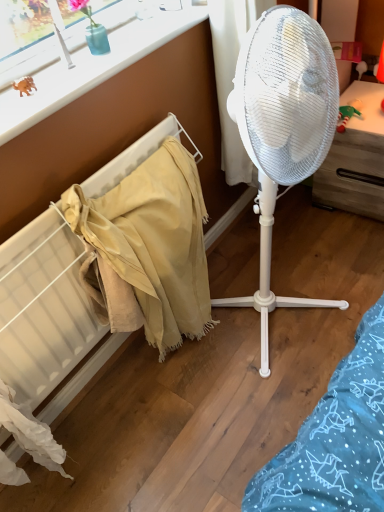
This screenshot has width=384, height=512. What do you see at coordinates (25, 86) in the screenshot? I see `rubber orange dinosaur at upper left` at bounding box center [25, 86].

Where is `white plastic drawer at right`? white plastic drawer at right is located at coordinates (356, 158).

This screenshot has width=384, height=512. What do you see at coordinates (119, 258) in the screenshot? I see `beige fabric at left` at bounding box center [119, 258].

Locate an element on the screen. white plastic window frame at upper left is located at coordinates (91, 69).

Image resolution: width=384 pixels, height=512 pixels. In the image, there is a white plastic window frame at upper left. What are the coordinates of `mechanical fan below it (from a real-world perspective)` in the screenshot? It's located at (282, 129).

Considering the positions of points (42, 117) and (247, 110), is point (42, 117) farther from camera compared to point (247, 110)?

Yes.

Is white plastic window frame at upper left not near white plastic fan at center?

No.

Relative to white plastic window frame at upper left, is white plastic fan at center in front or behind?

white plastic fan at center is positioned closer to the viewer than white plastic window frame at upper left.

Is white plastic fan at center smaller than white plastic window frame at upper left?

Actually, white plastic fan at center might be larger than white plastic window frame at upper left.

Between point (330, 129) and point (119, 32), which one is positioned behind?

The point (119, 32) is behind.

Is white plastic fan at center taller than white plastic window frame at upper left?

Correct, white plastic fan at center is much taller as white plastic window frame at upper left.

Is white plastic drawer at right inside or outside of white plastic window frame at upper left?

white plastic drawer at right is not inside white plastic window frame at upper left, it's outside.

Is white plastic drawer at right beside white plastic window frame at upper left?

No, white plastic drawer at right is not in contact with white plastic window frame at upper left.

Where is `furniture below the white plastic window frame at upper left (from a real-world perspective)`? The height and width of the screenshot is (512, 384). furniture below the white plastic window frame at upper left (from a real-world perspective) is located at coordinates (356, 158).

Can you tell me how much white plastic drawer at right and white plastic window frame at upper left differ in facing direction?

The angular difference between white plastic drawer at right and white plastic window frame at upper left is 89.4 degrees.

From the image's perspective, which one is positioned higher, rubber orange dinosaur at upper left or beige fabric at left?

rubber orange dinosaur at upper left.

Can you confirm if rubber orange dinosaur at upper left is taller than beige fabric at left?

No.

Locate an element on the screen. Image resolution: width=384 pixels, height=512 pixels. radiator directly beneath the rubber orange dinosaur at upper left (from a real-world perspective) is located at coordinates (119, 258).

Is rubber orange dinosaur at upper left not close to beige fabric at left?

rubber orange dinosaur at upper left is near beige fabric at left, not far away.

Looking at this image, can we say rubber orange dinosaur at upper left lies outside white plastic drawer at right?

rubber orange dinosaur at upper left is positioned outside white plastic drawer at right.

Considering the positions of objects rubber orange dinosaur at upper left and white plastic drawer at right in the image provided, who is in front, rubber orange dinosaur at upper left or white plastic drawer at right?

rubber orange dinosaur at upper left is closer to the camera.

Is rubber orange dinosaur at upper left at the left side of white plastic drawer at right?

Yes.

Does rubber orange dinosaur at upper left turn towards white plastic drawer at right?

No, rubber orange dinosaur at upper left does not turn towards white plastic drawer at right.

This screenshot has height=512, width=384. In order to click on toy above the white plastic fan at center (from the image's perspective) in this screenshot , I will do 25,86.

Can you confirm if white plastic fan at center is shorter than rubber orange dinosaur at upper left?

No, white plastic fan at center is not shorter than rubber orange dinosaur at upper left.

From a real-world perspective, between white plastic fan at center and rubber orange dinosaur at upper left, who is vertically lower?

From a 3D spatial view, white plastic fan at center is below.

Which object is further away from the camera taking this photo, white plastic fan at center or rubber orange dinosaur at upper left?

rubber orange dinosaur at upper left is further from the camera.

Is rubber orange dinosaur at upper left surrounded by white plastic drawer at right?

No, rubber orange dinosaur at upper left is located outside of white plastic drawer at right.

Which is more to the right, white plastic drawer at right or rubber orange dinosaur at upper left?

white plastic drawer at right.

What's the angular difference between white plastic drawer at right and rubber orange dinosaur at upper left's facing directions?

The angular difference between white plastic drawer at right and rubber orange dinosaur at upper left is 93.2 degrees.

Is white plastic drawer at right with rubber orange dinosaur at upper left?

No, white plastic drawer at right is not touching rubber orange dinosaur at upper left.

In order to click on mechanical fan in front of the white plastic window frame at upper left in this screenshot , I will do `click(282, 129)`.

I want to click on window frame behind the white plastic fan at center, so click(91, 69).

Estimate the real-world distances between objects in this image. Which object is closer to white plastic fan at center, white plastic window frame at upper left or beige fabric at left?

white plastic window frame at upper left lies closer to white plastic fan at center than the other object.

From the image, which object appears to be farther from rubber orange dinosaur at upper left, white plastic fan at center or white plastic window frame at upper left?

Among the two, white plastic fan at center is located further to rubber orange dinosaur at upper left.

Looking at the image, which one is located further to rubber orange dinosaur at upper left, white plastic drawer at right or beige fabric at left?

white plastic drawer at right is positioned further to the anchor rubber orange dinosaur at upper left.

Estimate the real-world distances between objects in this image. Which object is further from rubber orange dinosaur at upper left, beige fabric at left or white plastic drawer at right?

The object further to rubber orange dinosaur at upper left is white plastic drawer at right.

Which object lies nearer to the anchor point white plastic fan at center, rubber orange dinosaur at upper left or white plastic window frame at upper left?

Based on the image, white plastic window frame at upper left appears to be nearer to white plastic fan at center.

Considering their positions, is rubber orange dinosaur at upper left positioned closer to beige fabric at left than white plastic drawer at right?

rubber orange dinosaur at upper left is closer to beige fabric at left.

Estimate the real-world distances between objects in this image. Which object is closer to beige fabric at left, white plastic drawer at right or white plastic window frame at upper left?

white plastic window frame at upper left lies closer to beige fabric at left than the other object.

Which object lies nearer to the anchor point rubber orange dinosaur at upper left, white plastic window frame at upper left or white plastic drawer at right?

white plastic window frame at upper left lies closer to rubber orange dinosaur at upper left than the other object.

Image resolution: width=384 pixels, height=512 pixels. I want to click on window frame situated between beige fabric at left and white plastic drawer at right from left to right, so click(x=91, y=69).

Where is `radiator situated between rubber orange dinosaur at upper left and white plastic fan at center from left to right`? radiator situated between rubber orange dinosaur at upper left and white plastic fan at center from left to right is located at coordinates tap(119, 258).

Image resolution: width=384 pixels, height=512 pixels. What are the coordinates of `window frame between rubber orange dinosaur at upper left and white plastic drawer at right` in the screenshot? It's located at (91, 69).

Identify the location of radiator located between rubber orange dinosaur at upper left and white plastic drawer at right in the left-right direction. The height and width of the screenshot is (512, 384). (119, 258).